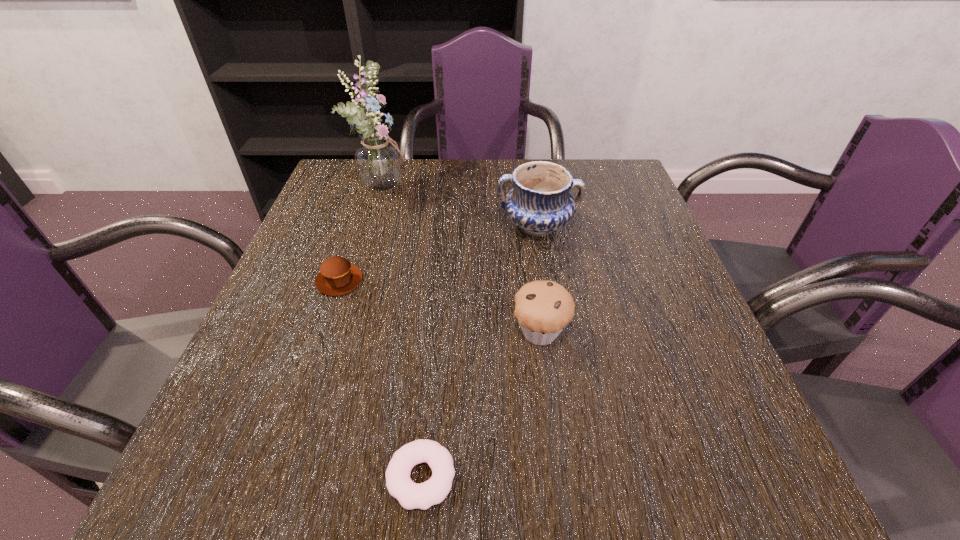
Identify the location of free spot at the left edge of the desktop. This screenshot has width=960, height=540. (234, 403).

At what (x,y) coordinates should I click in order to perform the action: click on vacant region at the right edge of the desktop. Please return your answer as a coordinate pair (x, y). The image size is (960, 540). Looking at the image, I should click on (629, 219).

Find the location of a particular element. free space at the far right corner is located at coordinates (578, 168).

Find the location of `free region at the near right corner`. free region at the near right corner is located at coordinates (720, 481).

The height and width of the screenshot is (540, 960). What are the coordinates of `blank region between the taller muffin and the nearest object` in the screenshot? It's located at (481, 404).

The height and width of the screenshot is (540, 960). Identify the location of free space between the pottery and the bouquet. 461,206.

Locate an element on the screen. free space that is in between the shortest object and the nearer muffin is located at coordinates (481, 404).

Identify the location of unoccupied position between the bouquet and the doughnut. (403, 331).

This screenshot has height=540, width=960. In order to click on free space that is in between the right muffin and the third nearest object in this screenshot , I will do `click(440, 306)`.

I want to click on free point between the third object from left to right and the tallest object, so click(x=403, y=331).